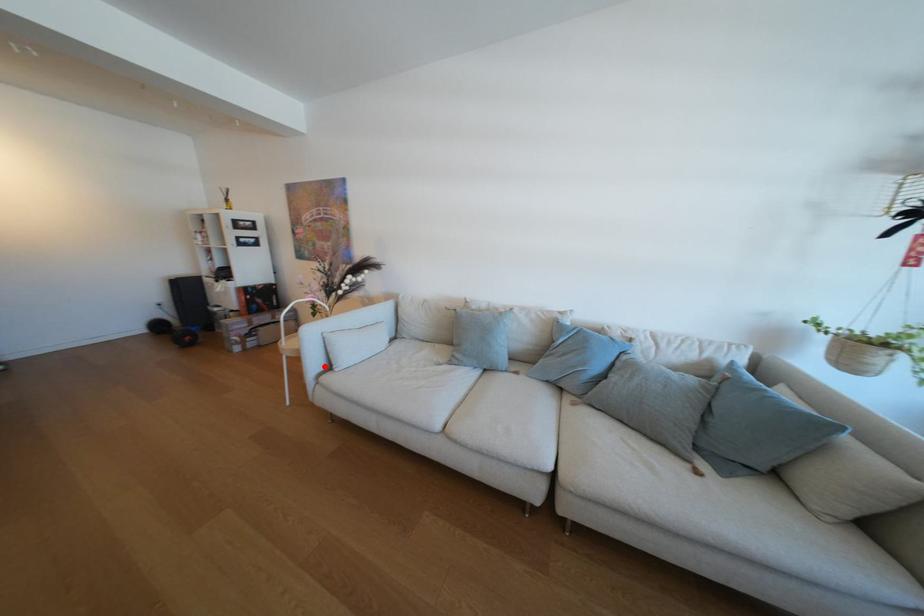
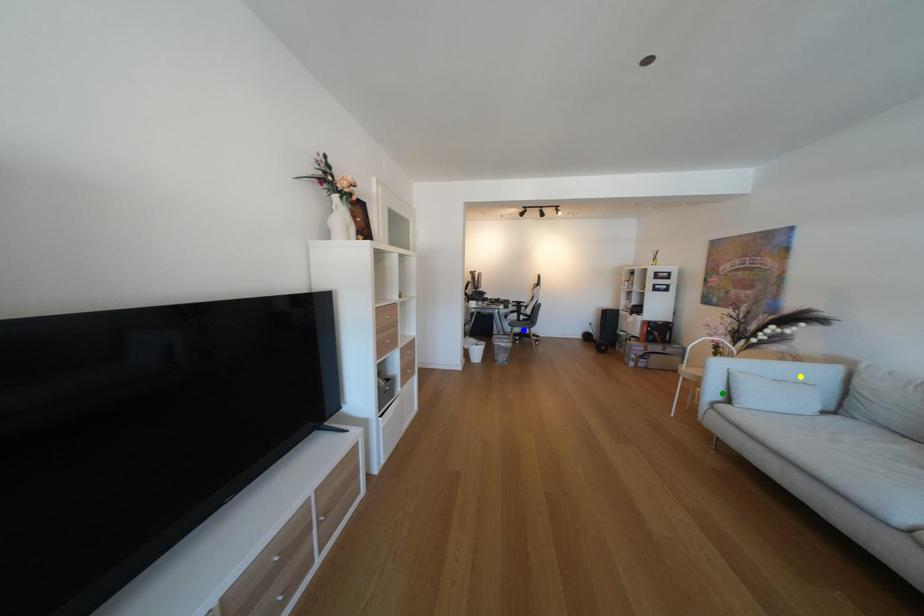
Question: I am providing you with two images of the same scene from different viewpoints. A red point is marked on the first image. You are given multiple points on the second image. Which spot in image 2 lines up with the point in image 1?

Choices:
 (A) blue point
 (B) yellow point
 (C) green point

Answer: (C)